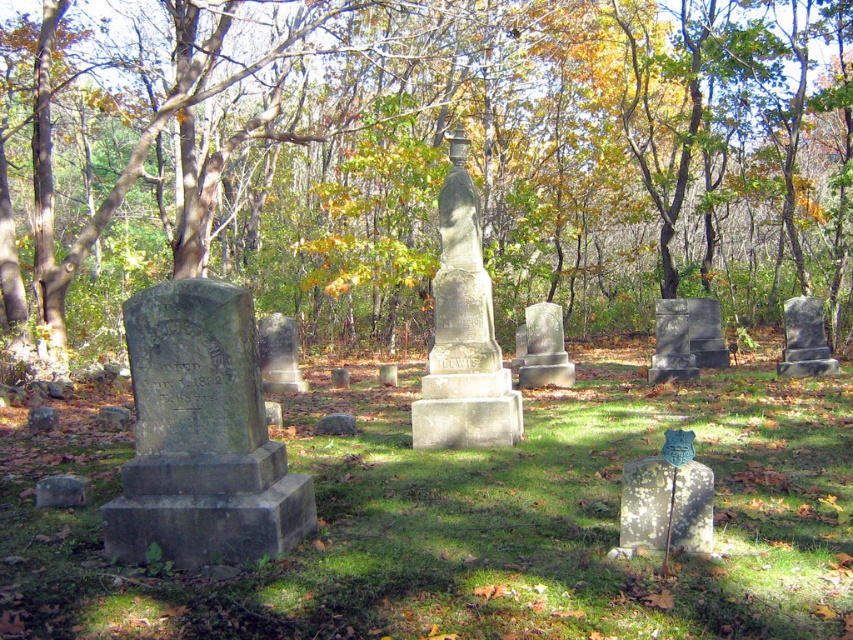
Is green grass at center closer to the viewer compared to speckled stone gravestone at lower right?

That is True.

Can you confirm if green grass at center is smaller than speckled stone gravestone at lower right?

Incorrect, green grass at center is not smaller in size than speckled stone gravestone at lower right.

Where is `green grass at center`? Image resolution: width=853 pixels, height=640 pixels. green grass at center is located at coordinates (473, 518).

Does point (851, 586) lie in front of point (810, 336)?

Yes, point (851, 586) is in front of point (810, 336).

Is green grass at center positioned in front of dark gray stone gravestone at right?

Yes, it is.

This screenshot has height=640, width=853. What do you see at coordinates (473, 518) in the screenshot? I see `green grass at center` at bounding box center [473, 518].

At what (x,y) coordinates should I click in order to perform the action: click on green grass at center. Please return your answer as a coordinate pair (x, y). Looking at the image, I should click on (473, 518).

Who is positioned more to the right, gray stone gravestone at center or gray stone gravestone at lower left?

From the viewer's perspective, gray stone gravestone at center appears more on the right side.

Who is positioned more to the left, gray stone gravestone at center or gray stone gravestone at lower left?

From the viewer's perspective, gray stone gravestone at lower left appears more on the left side.

This screenshot has width=853, height=640. What are the coordinates of `gray stone gravestone at center` in the screenshot? It's located at (686, 339).